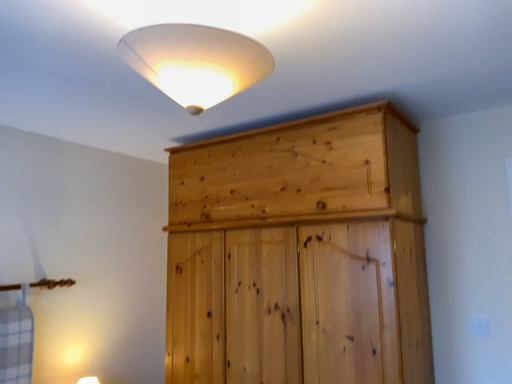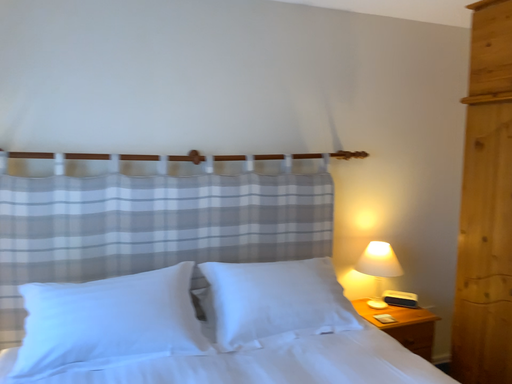
Question: How did the camera likely rotate when shooting the video?

Choices:
 (A) rotated downward
 (B) rotated upward

Answer: (A)